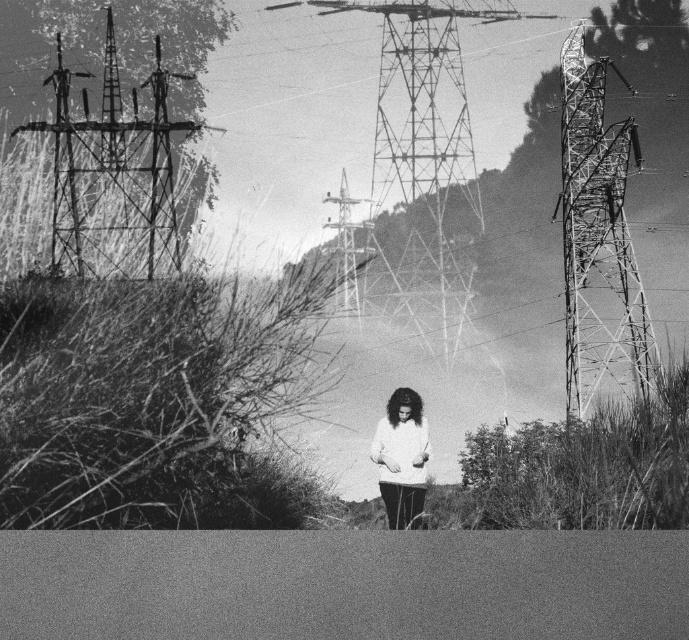
Question: Does metallic wire tower at right have a lesser width compared to white matte sweater at center?

Choices:
 (A) yes
 (B) no

Answer: (B)

Question: Which of these objects is positioned closest to the white matte sweater at center?

Choices:
 (A) metallic tower at center
 (B) metallic grid structure at left
 (C) metallic wire tower at right

Answer: (A)

Question: Can you confirm if metallic wire tower at right is positioned to the left of white matte sweater at center?

Choices:
 (A) yes
 (B) no

Answer: (B)

Question: Is white matte sweater at center wider than metallic tower at center?

Choices:
 (A) yes
 (B) no

Answer: (A)

Question: Which of the following is the closest to the observer?

Choices:
 (A) white matte sweater at center
 (B) metallic wire tower at right
 (C) metallic grid structure at left

Answer: (A)

Question: Based on their relative distances, which object is nearer to the white matte sweater at center?

Choices:
 (A) metallic wire tower at right
 (B) metallic grid structure at left

Answer: (A)